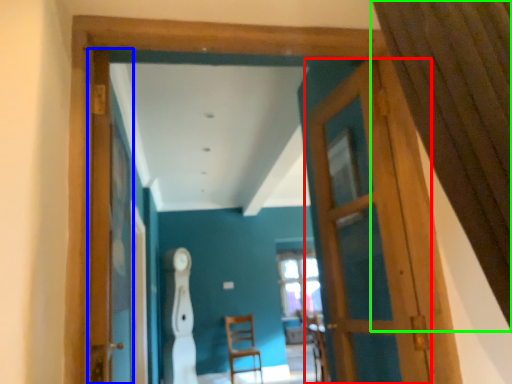
Question: Estimate the real-world distances between objects in this image. Which object is farther from door (highlighted by a red box), screen door (highlighted by a blue box) or curtain (highlighted by a green box)?

Choices:
 (A) screen door
 (B) curtain

Answer: (A)